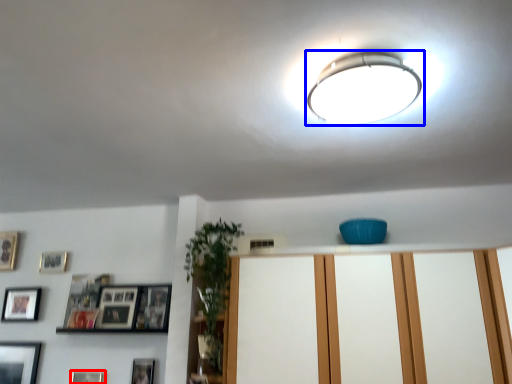
Question: Which point is further to the camera, picture frame (highlighted by a red box) or lamp (highlighted by a blue box)?

Choices:
 (A) picture frame
 (B) lamp

Answer: (A)